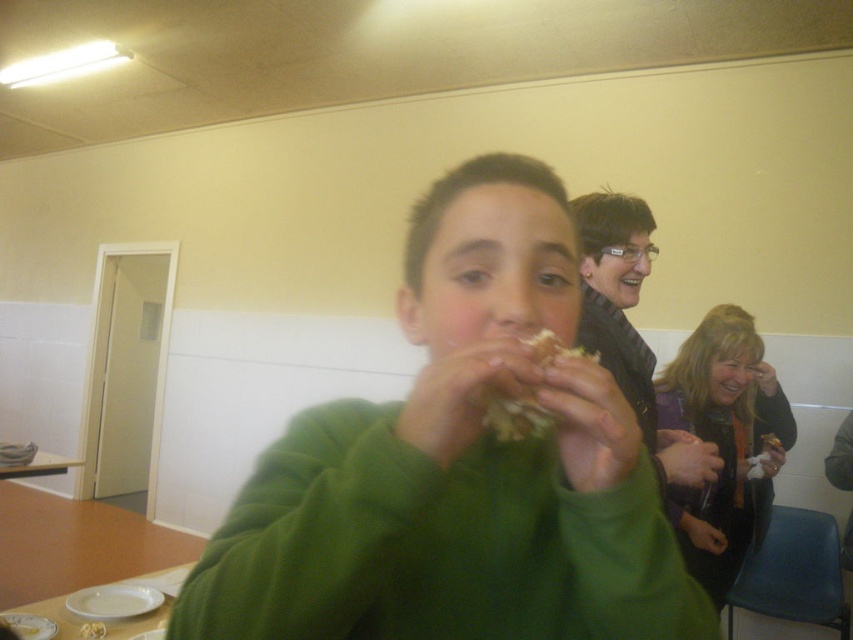
Consider the image. You are standing in the dining area and notice the matte black jacket at upper right. If you want to reach it without moving from your current position, is it within arm s reach?

The matte black jacket at upper right is 3.78 feet away from the viewer, which is beyond typical arm reach. You would need to move closer to grab it.

You are a photographer trying to capture a candid shot of the scene. You need to ensure that both the green matte sweater at center and the wooden table at lower left are visible in the frame. Based on their positions, which object should you focus on first to include both in the shot?

The green matte sweater at center is positioned on the right side of wooden table at lower left, so focusing on the wooden table at lower left first would allow you to frame both objects since the sweater is to the right of the table.